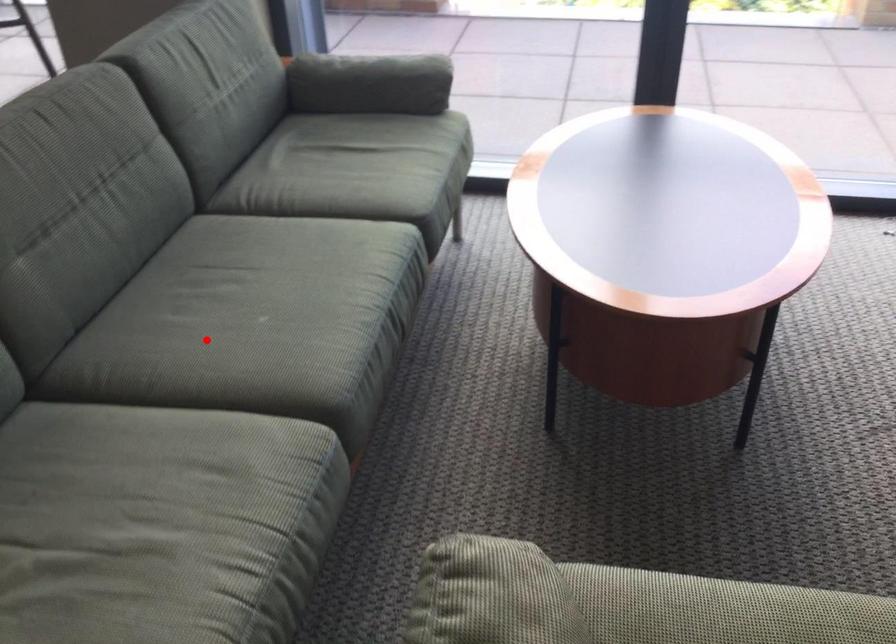
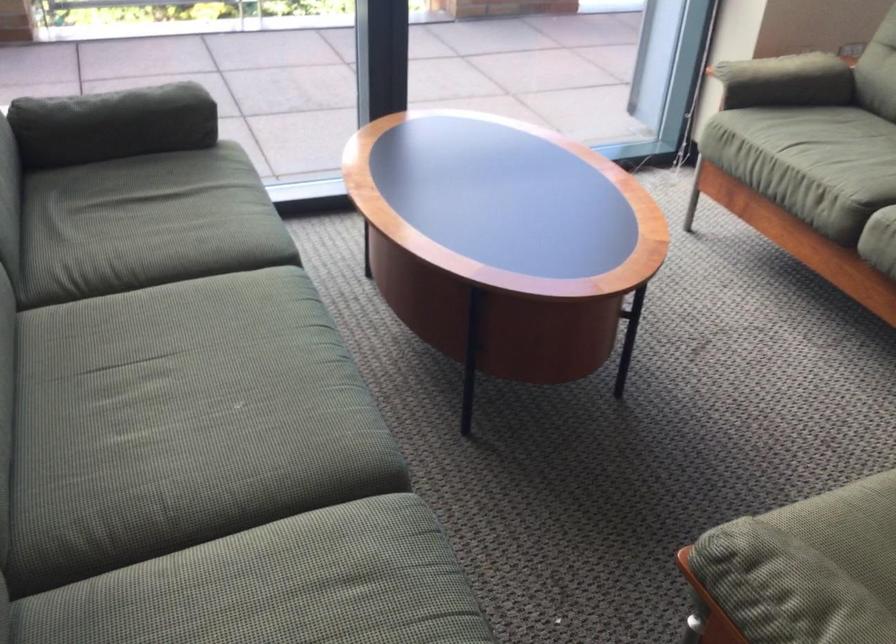
In the second image, find the point that corresponds to the highlighted location in the first image.

(197, 446)